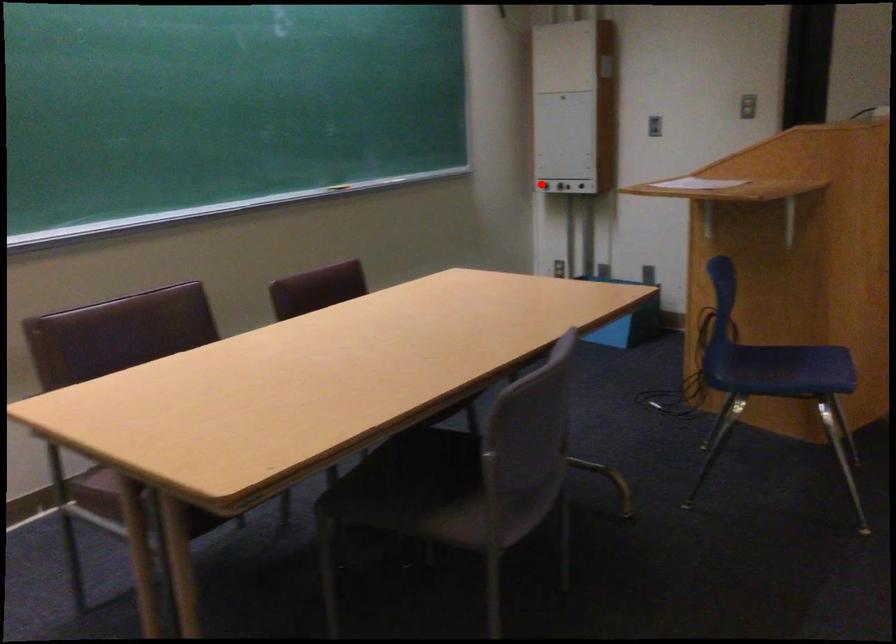
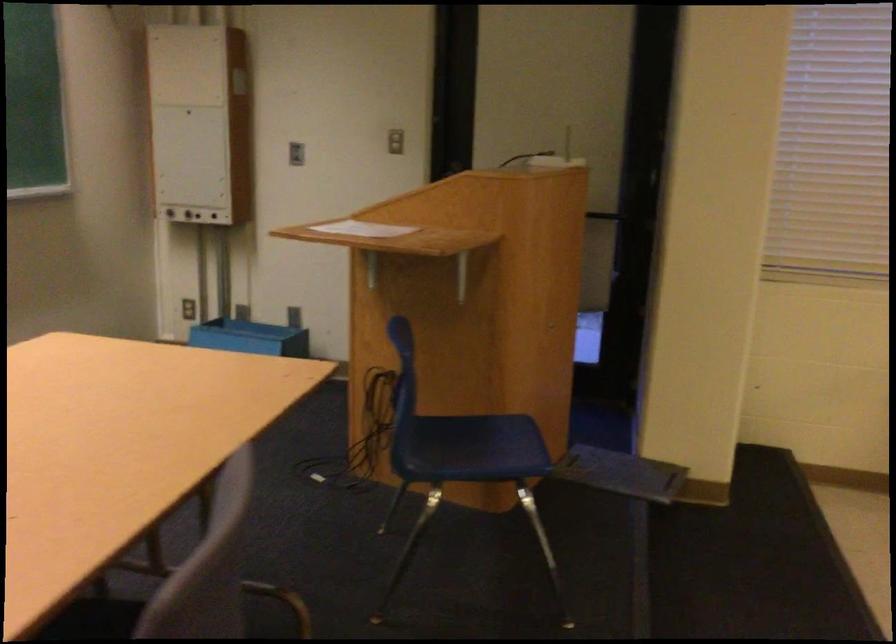
Question: I am providing you with two images of the same scene from different viewpoints. Given a red point in image1, look at the same physical point in image2. Is it:

Choices:
 (A) Closer to the viewpoint
 (B) Farther from the viewpoint

Answer: (A)